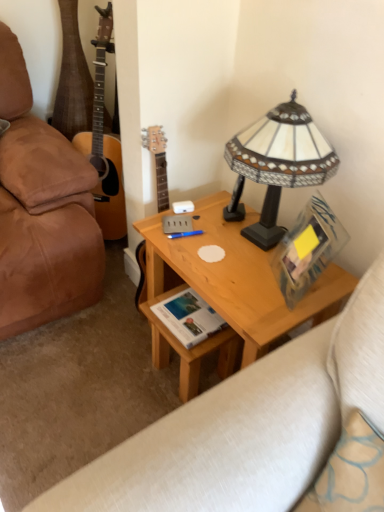
I want to click on free space to the left of stained glass lampshade at upper right, so click(193, 231).